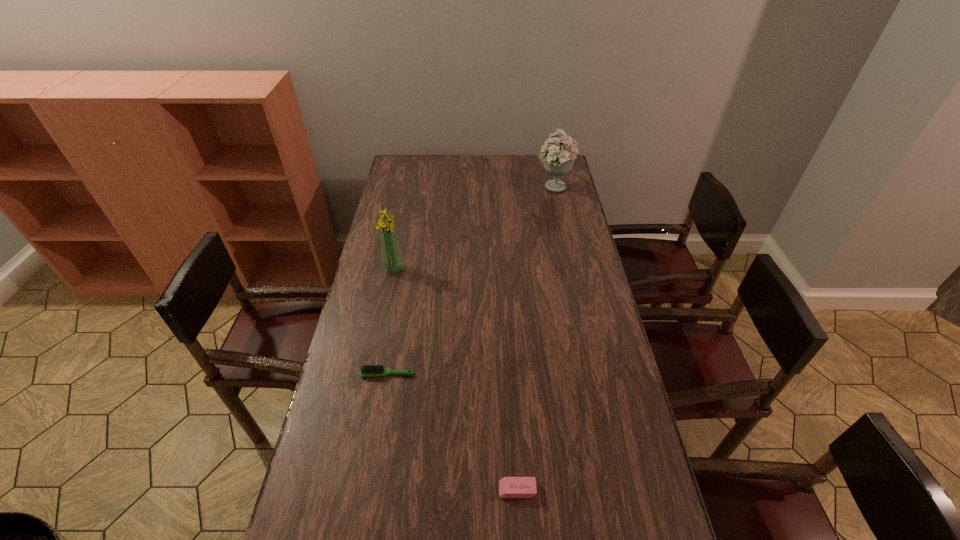
I want to click on vacant space located 0.150m on the left of the eraser, so click(x=440, y=490).

Identify the location of object that is at the far edge. (558, 160).

Locate an element on the screen. This screenshot has height=540, width=960. bouquet situated at the left edge is located at coordinates (392, 258).

Identify the location of hairbrush positioned at the left edge. (368, 370).

At what (x,y) coordinates should I click in order to perform the action: click on object that is positioned at the right edge. Please return your answer as a coordinate pair (x, y). Looking at the image, I should click on (558, 160).

The width and height of the screenshot is (960, 540). What are the coordinates of `object that is at the far right corner` in the screenshot? It's located at tap(558, 160).

Find the location of a particular element. vacant space at the far edge of the desktop is located at coordinates (511, 179).

You are a GUI agent. You are given a task and a screenshot of the screen. Output one action in this format:
    pyautogui.click(x=<x>, y=<y>)
    Task: Click on the free spot at the left edge of the desktop
    This screenshot has width=960, height=540.
    Given the screenshot: What is the action you would take?
    [x=354, y=422]

Where is `free spot at the right edge of the desktop`? The width and height of the screenshot is (960, 540). free spot at the right edge of the desktop is located at coordinates (631, 400).

Find the location of a particular element. The image size is (960, 540). vacant space in between the third nearest object and the eraser is located at coordinates (456, 380).